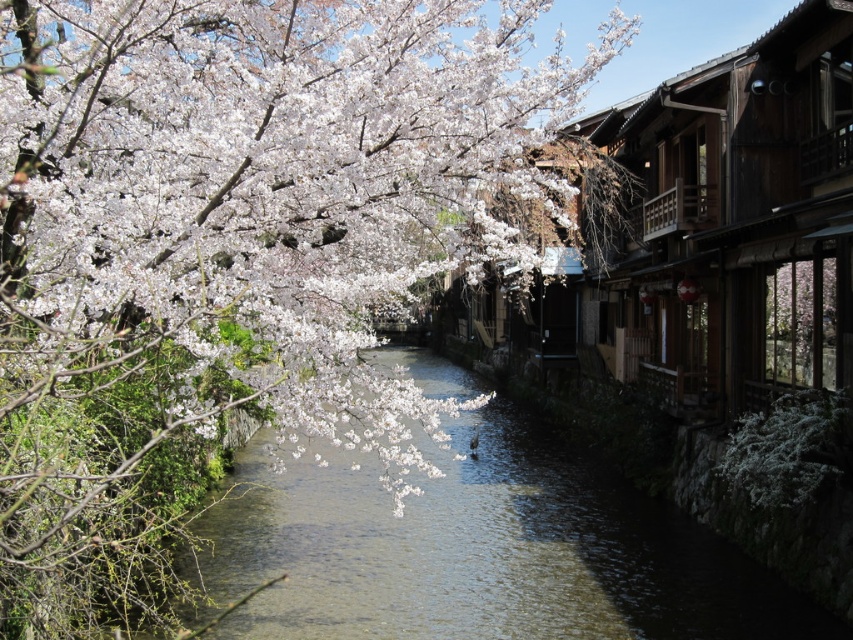
Locate an element on the screen. The image size is (853, 640). white matte flower at upper left is located at coordinates (260, 184).

This screenshot has height=640, width=853. What are the coordinates of `white matte flower at upper left` in the screenshot? It's located at (260, 184).